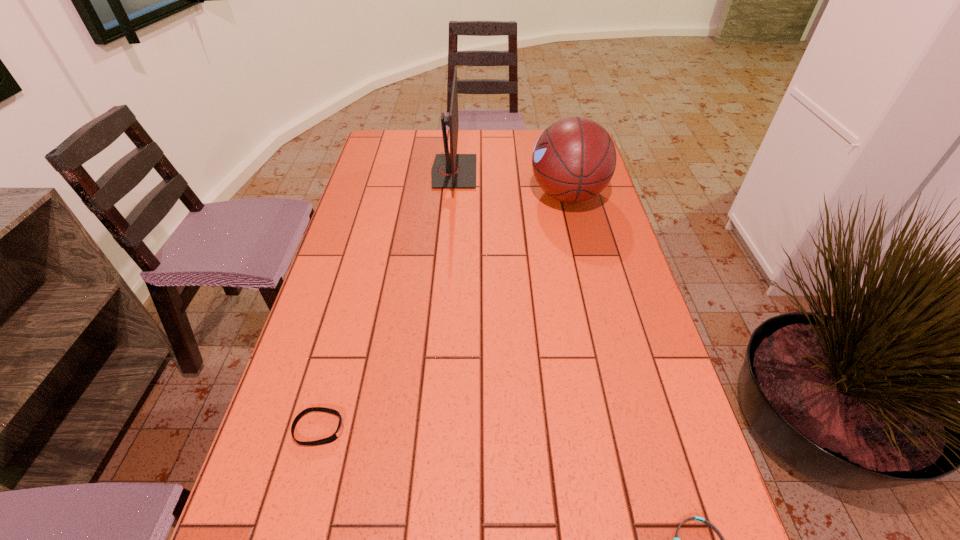
Locate an element on the screen. vacant point that satisfies the following two spatial constraints: 1. on the back side of the second tallest object; 2. on the screen side of the second object from left to right is located at coordinates (563, 172).

The height and width of the screenshot is (540, 960). Find the location of `vacant area in the image that satisfies the following two spatial constraints: 1. on the screen side of the second object from left to right; 2. on the left side of the second tallest object`. vacant area in the image that satisfies the following two spatial constraints: 1. on the screen side of the second object from left to right; 2. on the left side of the second tallest object is located at coordinates (452, 195).